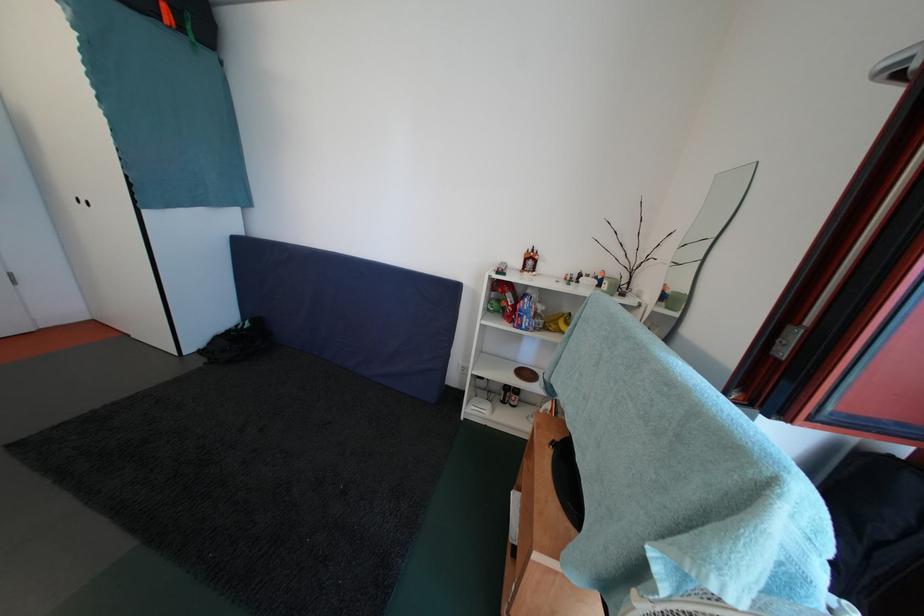
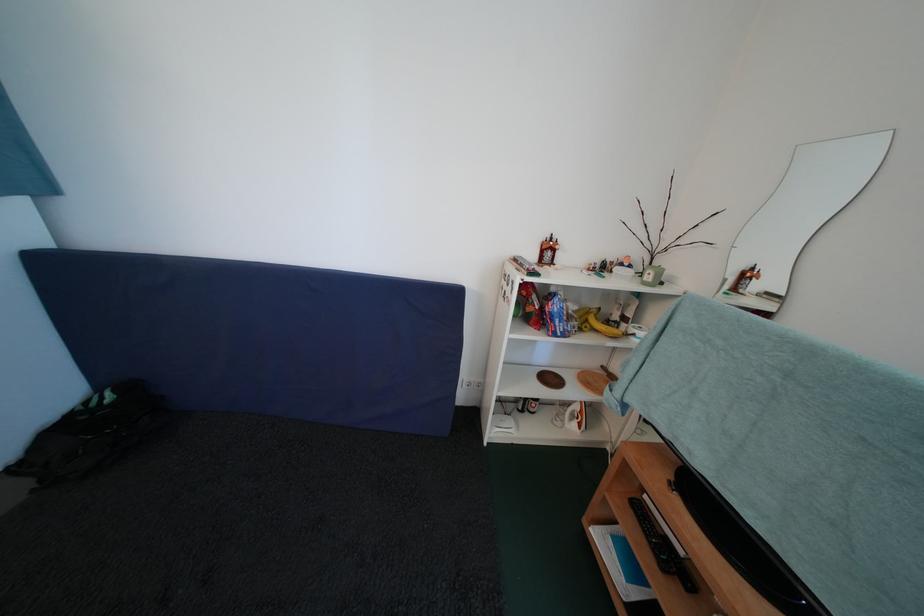
What movement of the cameraman would produce the second image?

The movement direction of the cameraman is left, forward.